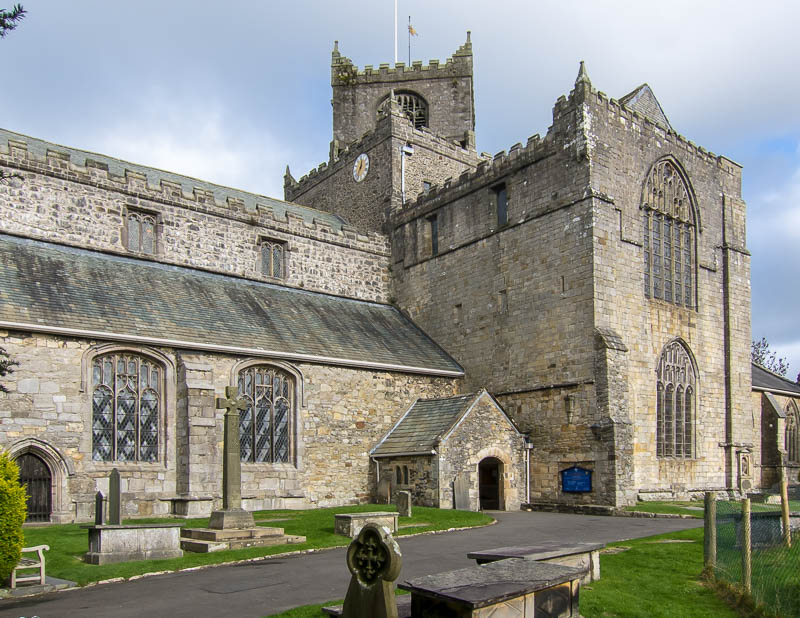
I want to click on bench, so click(22, 568).